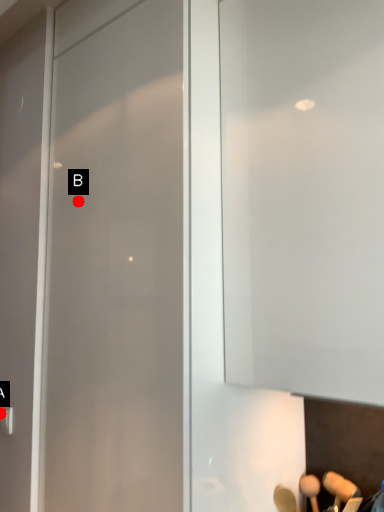
Question: Two points are circled on the image, labeled by A and B beside each circle. Which point is closer to the camera taking this photo?

Choices:
 (A) A is closer
 (B) B is closer

Answer: (B)